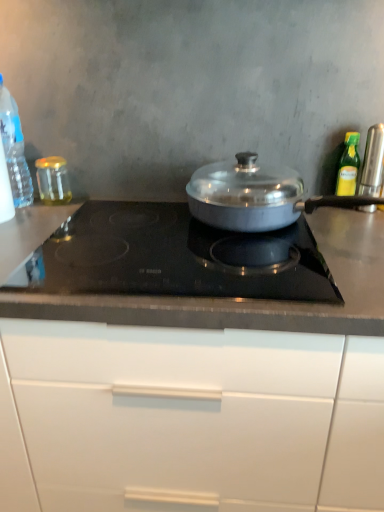
This screenshot has height=512, width=384. I want to click on vacant area on top of white glossy cabinet at center (from a real-world perspective), so click(173, 243).